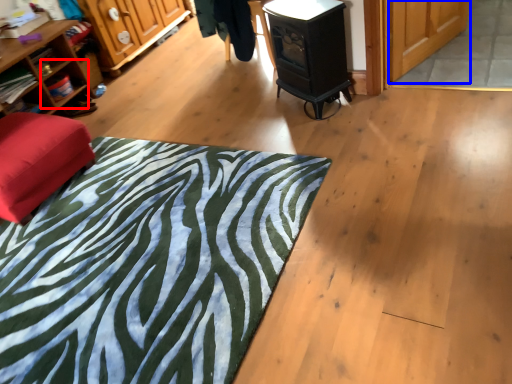
Question: Which object is closer to the camera taking this photo, shelf (highlighted by a red box) or screen door (highlighted by a blue box)?

Choices:
 (A) shelf
 (B) screen door

Answer: (B)